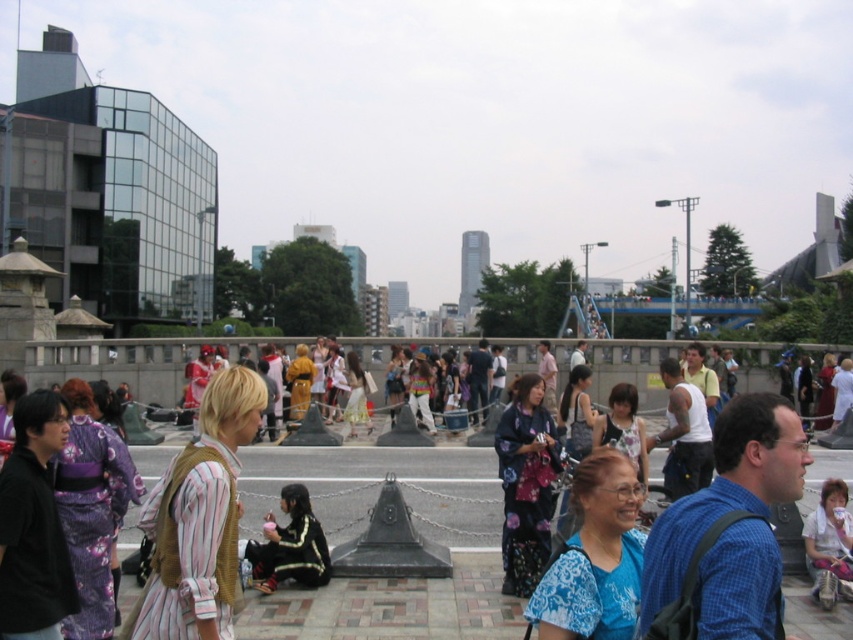
You are standing in the urban scene and want to move from the point at coordinates point (584, 556) to the point at coordinates point (828, 563). Which direction should you face to walk towards the second point?

Point (584, 556) is closer to the viewer than point (828, 563). To walk towards the second point, you should face away from the viewer, moving upwards and slightly to the right.

You are a photographer setting up a tripod in this urban scene. You need to position it so that it doesn not block the view of the blue floral blouse at center and the white cotton shirt at lower right. Given their sizes, which of the two requires more space to accommodate its width?

The blue floral blouse at center requires more space because its width is larger than that of the white cotton shirt at lower right.